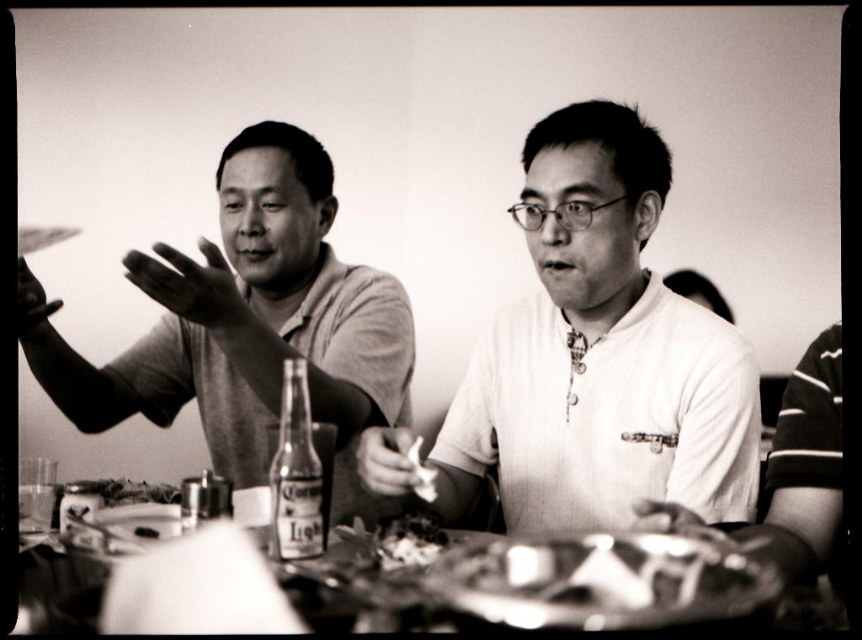
You are a photographer adjusting the lighting for a portrait. You need to ensure that the white textured shirt at center and the dark textured food at center are both well lit. According to the scene description, which object should you focus the light on first to ensure proper exposure?

The white textured shirt at center is in front of the dark textured food at center. Since the shirt is closer to the camera, focusing the light on it first will ensure proper exposure without overexposing the darker food behind it.

You are standing in front of the table and want to place a small object on the table. If you want to place it closer to you, which point should you choose between point (678, 416) and point (319, 524)?

You should choose point (678, 416) because it is closer to you than point (319, 524).

You are a photographer adjusting the focus on your camera. You want to capture both the white textured shirt at center and the clear glass bottle at center in sharp detail. Which object should you focus on first to ensure both are in focus?

You should focus on the white textured shirt at center first because it is larger in size than the clear glass bottle at center, so ensuring its sharpness will help both objects be in focus.